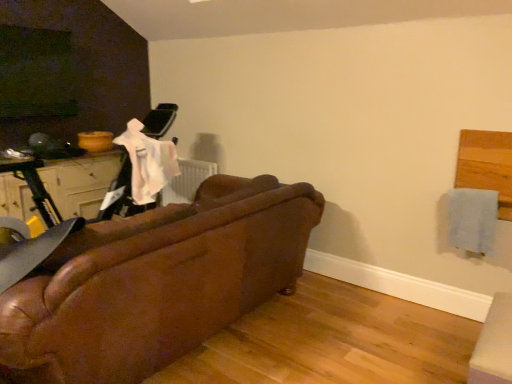
Question: Can you confirm if light blue fabric at upper right is wider than matte white drawer at left?

Choices:
 (A) yes
 (B) no

Answer: (B)

Question: Does light blue fabric at upper right come in front of matte white drawer at left?

Choices:
 (A) yes
 (B) no

Answer: (A)

Question: Can you confirm if light blue fabric at upper right is positioned to the right of matte white drawer at left?

Choices:
 (A) yes
 (B) no

Answer: (A)

Question: Are light blue fabric at upper right and matte white drawer at left located far from each other?

Choices:
 (A) no
 (B) yes

Answer: (B)

Question: Is light blue fabric at upper right smaller than matte white drawer at left?

Choices:
 (A) yes
 (B) no

Answer: (A)

Question: Considering their positions, is matte white drawer at left located in front of or behind leather couch at center?

Choices:
 (A) behind
 (B) front

Answer: (A)

Question: Considering the positions of matte white drawer at left and leather couch at center in the image, is matte white drawer at left wider or thinner than leather couch at center?

Choices:
 (A) wide
 (B) thin

Answer: (B)

Question: Which is correct: matte white drawer at left is inside leather couch at center, or outside of it?

Choices:
 (A) outside
 (B) inside

Answer: (A)

Question: Is point (69, 188) positioned closer to the camera than point (308, 200)?

Choices:
 (A) farther
 (B) closer

Answer: (A)

Question: From a real-world perspective, is light blue fabric at upper right positioned above or below leather couch at center?

Choices:
 (A) below
 (B) above

Answer: (B)

Question: Looking at their shapes, would you say light blue fabric at upper right is wider or thinner than leather couch at center?

Choices:
 (A) thin
 (B) wide

Answer: (A)

Question: Considering the relative positions of light blue fabric at upper right and leather couch at center in the image provided, is light blue fabric at upper right to the left or to the right of leather couch at center?

Choices:
 (A) left
 (B) right

Answer: (B)

Question: Would you say light blue fabric at upper right is inside or outside leather couch at center?

Choices:
 (A) inside
 (B) outside

Answer: (B)

Question: Would you say leather couch at center is to the left or to the right of matte white drawer at left in the picture?

Choices:
 (A) left
 (B) right

Answer: (B)

Question: Considering the positions of point (32, 281) and point (102, 180), is point (32, 281) closer or farther from the camera than point (102, 180)?

Choices:
 (A) farther
 (B) closer

Answer: (B)